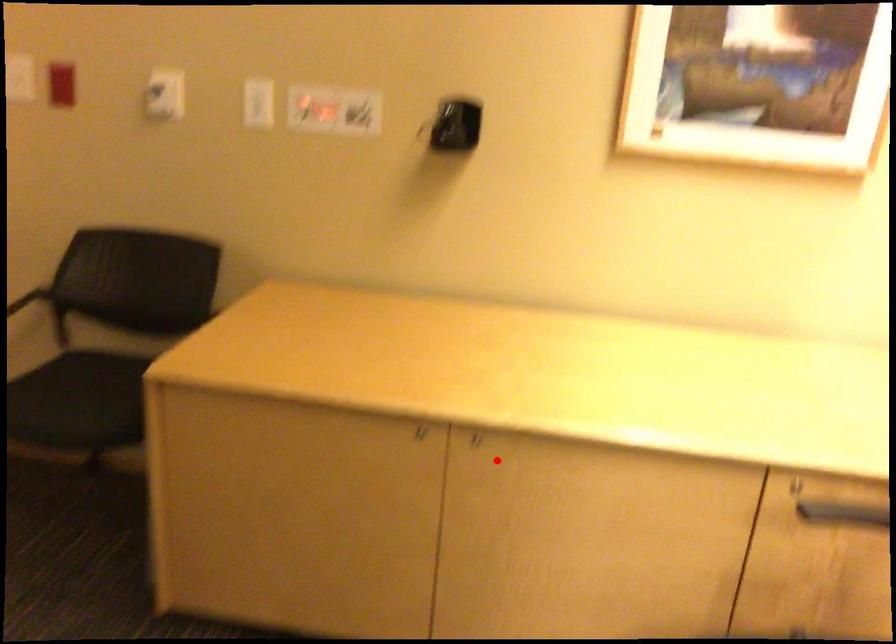
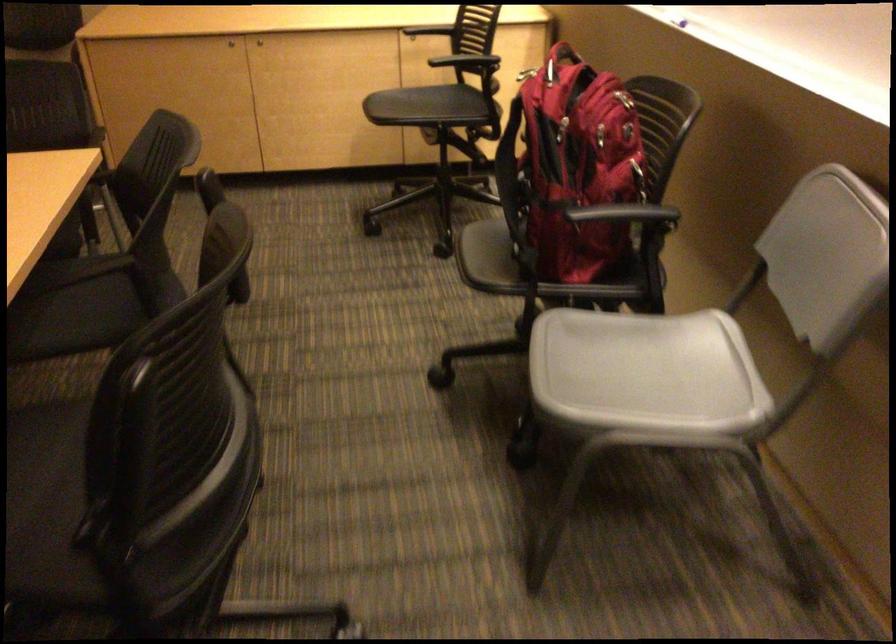
Find the pixel in the second image that matches the highlighted location in the first image.

(259, 41)